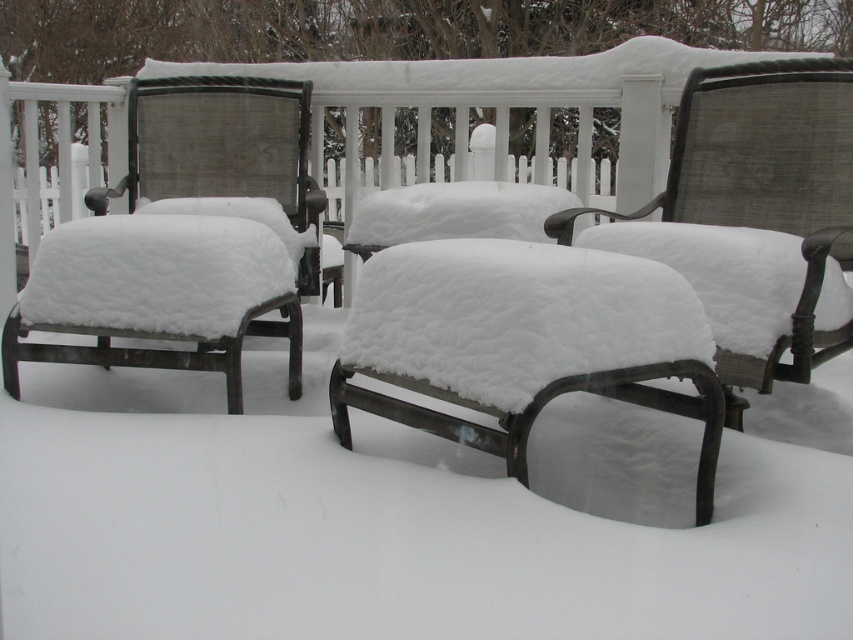
You are standing in the snowy outdoor scene and want to determine which of the two points, point (674,337) or point (782,256), is closer to you. Based on the image, which point is nearer?

Point (674,337) is closer to the camera than point (782,256), so it is the nearer one.